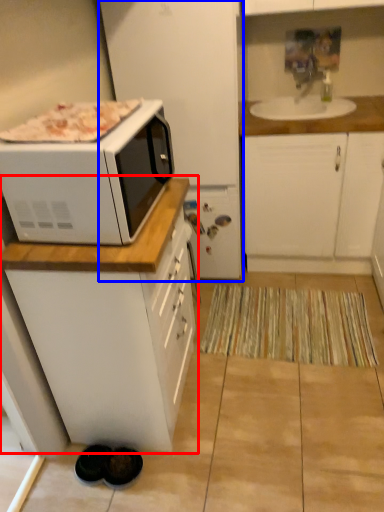
Question: Which object appears farthest to the camera in this image, cabinetry (highlighted by a red box) or appliance (highlighted by a blue box)?

Choices:
 (A) cabinetry
 (B) appliance

Answer: (B)